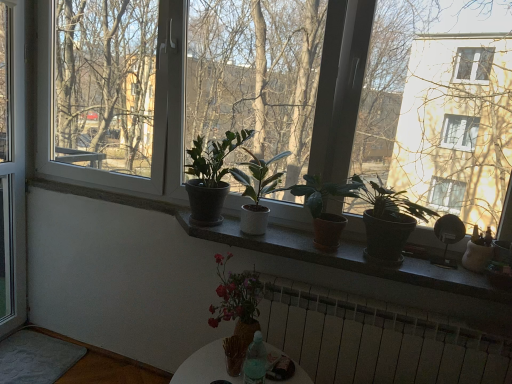
Locate an element on the screen. free location to the right of transparent glass window at left is located at coordinates (33, 341).